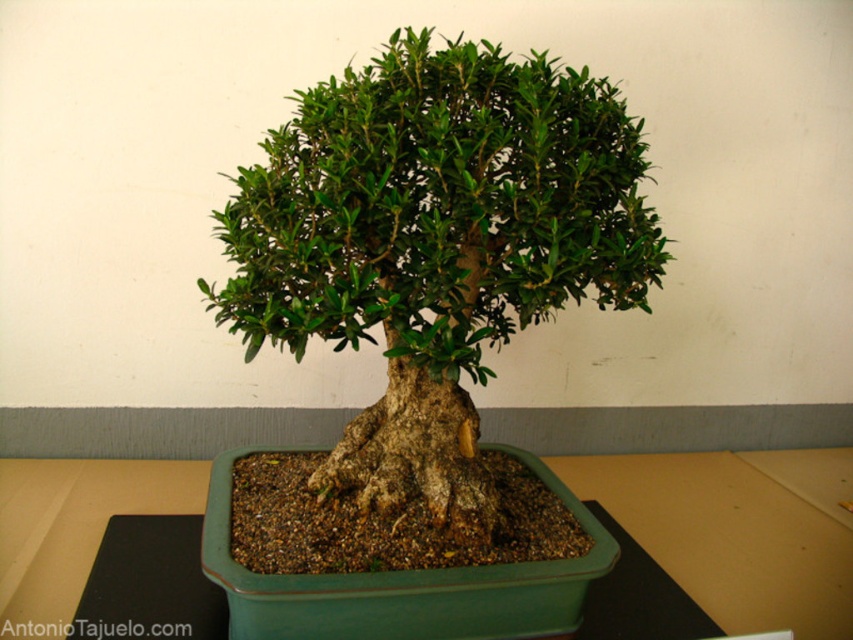
Between green matte bonsai tree at center and green ceramic pot at center, which one is positioned lower?

Positioned lower is green ceramic pot at center.

Who is positioned more to the right, green matte bonsai tree at center or green ceramic pot at center?

green matte bonsai tree at center

Is point (422, 435) closer to viewer compared to point (207, 593)?

No.

This screenshot has height=640, width=853. What are the coordinates of `green matte bonsai tree at center` in the screenshot? It's located at (434, 243).